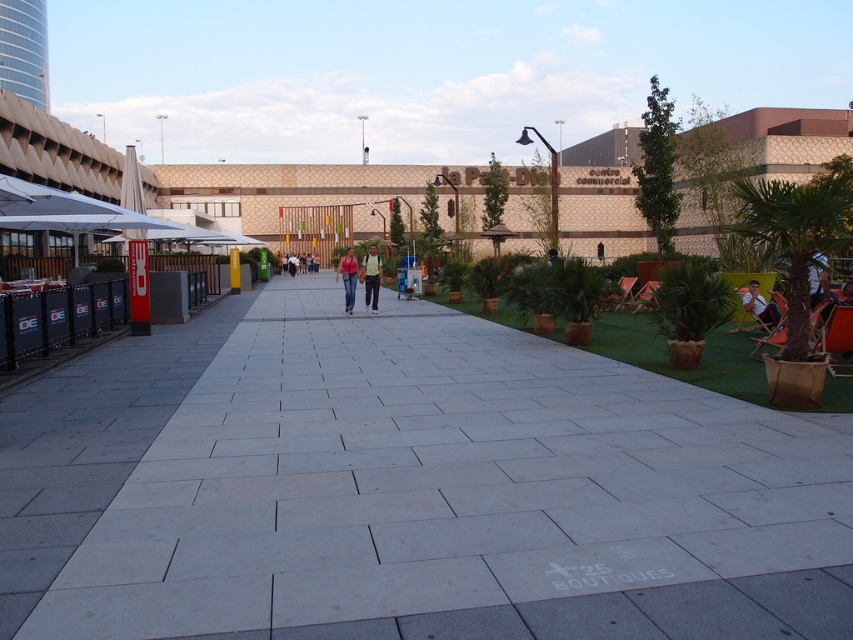
Question: Is light brown leather chair at right smaller than white fabric chair at right?

Choices:
 (A) yes
 (B) no

Answer: (B)

Question: Can you confirm if light brown leather chair at right is positioned to the right of white fabric chair at right?

Choices:
 (A) yes
 (B) no

Answer: (B)

Question: Is white fabric chair at right in front of pink fabric top at center?

Choices:
 (A) yes
 (B) no

Answer: (A)

Question: Which point is closer to the camera?

Choices:
 (A) green cotton shirt at center
 (B) gray concrete pavement at center

Answer: (B)

Question: Estimate the real-world distances between objects in this image. Which object is closer to the brown woven chair at center-right?

Choices:
 (A) green cotton shirt at center
 (B) pink fabric top at center
 (C) light brown leather chair at right

Answer: (C)

Question: Which object is the closest to the green fabric chair at center?

Choices:
 (A) white fabric chair at right
 (B) gray concrete pavement at center
 (C) pink fabric top at center

Answer: (A)